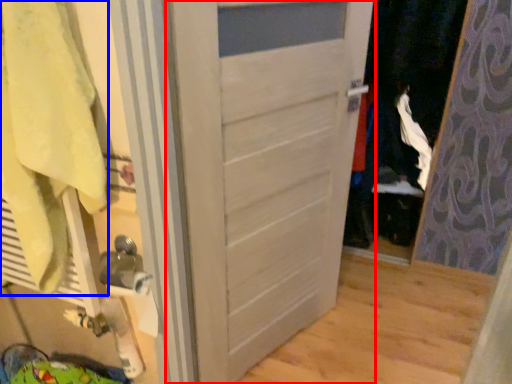
Question: Among these objects, which one is nearest to the camera, door (highlighted by a red box) or bath towel (highlighted by a blue box)?

Choices:
 (A) door
 (B) bath towel

Answer: (B)